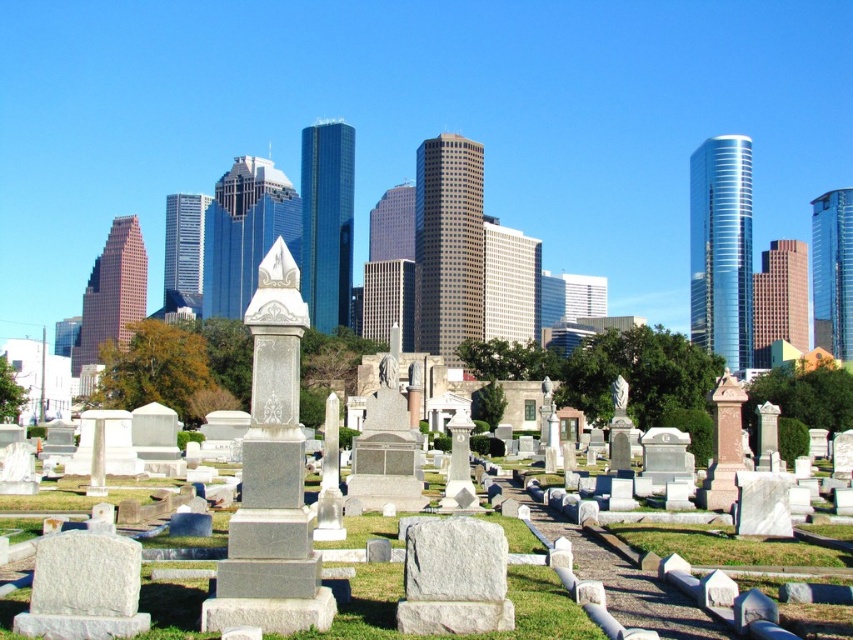
Question: Does green grass at center have a lesser width compared to gray stone gravestone at center?

Choices:
 (A) yes
 (B) no

Answer: (B)

Question: Among these points, which one is farthest from the camera?

Choices:
 (A) (196, 612)
 (B) (479, 568)

Answer: (A)

Question: Is green grass at center to the left of gray stone gravestone at center from the viewer's perspective?

Choices:
 (A) no
 (B) yes

Answer: (B)

Question: From the image, what is the correct spatial relationship of green grass at center in relation to gray stone gravestone at center?

Choices:
 (A) left
 (B) right

Answer: (A)

Question: Which of the following is the farthest from the observer?

Choices:
 (A) gray stone gravestone at center
 (B) green grass at center

Answer: (A)